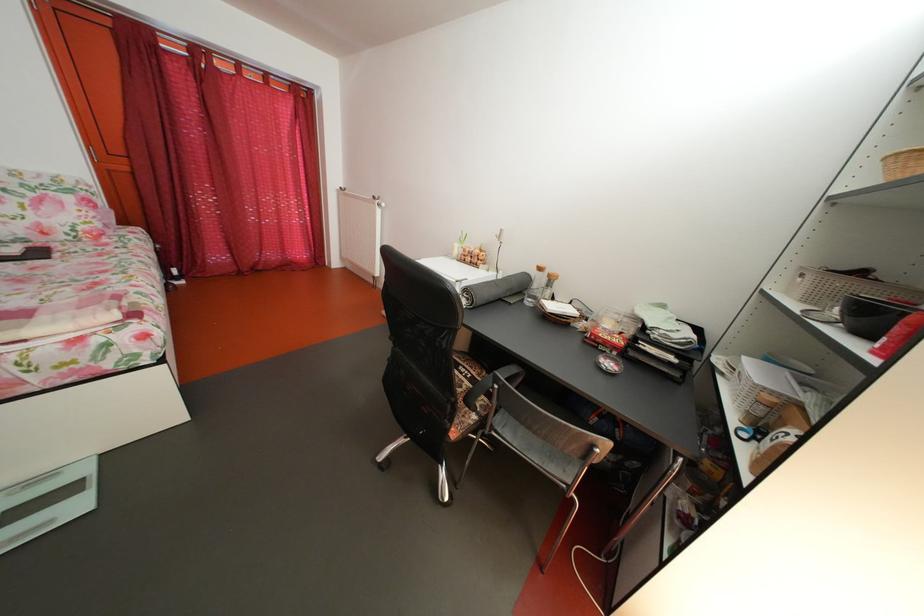
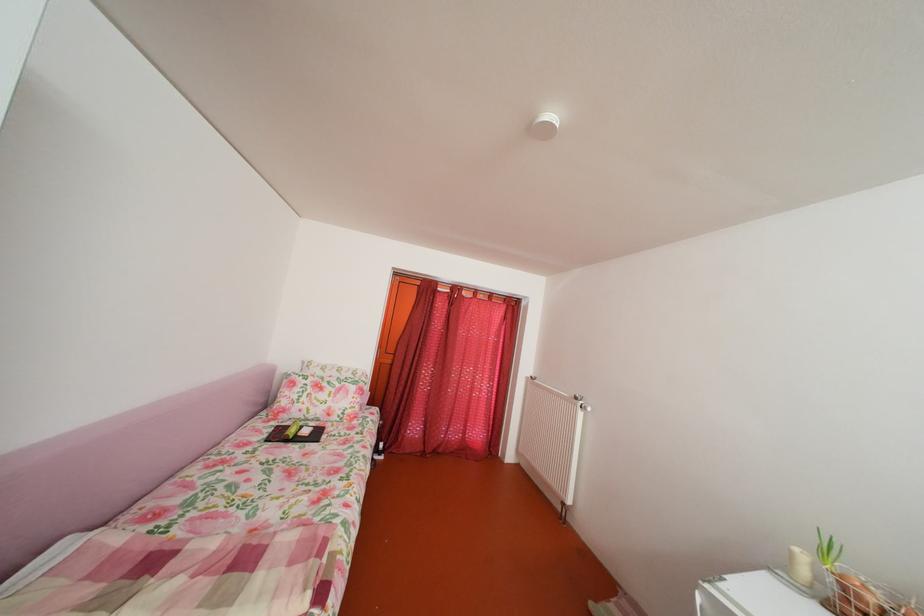
Where in the second image is the point corresponding to point (479, 256) from the first image?

(882, 607)